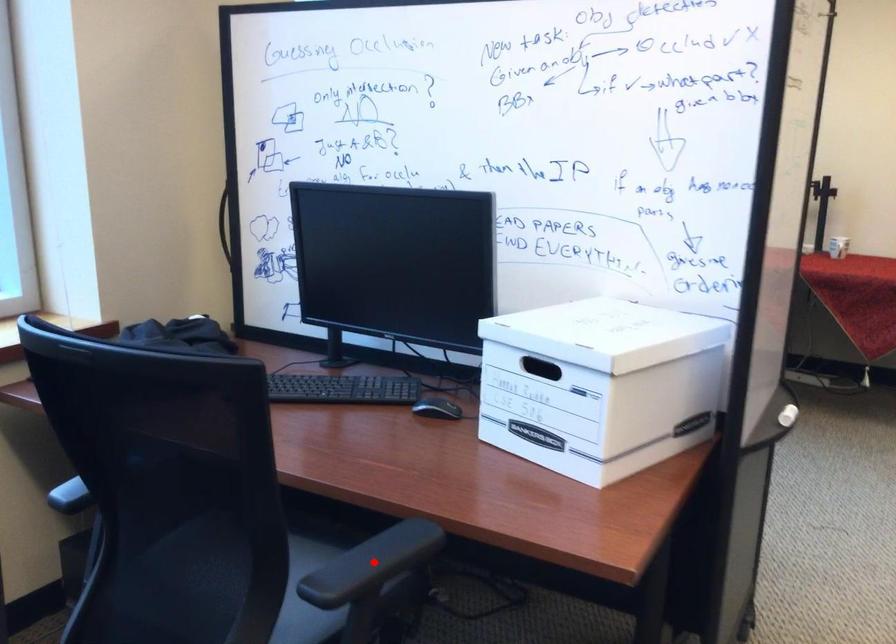
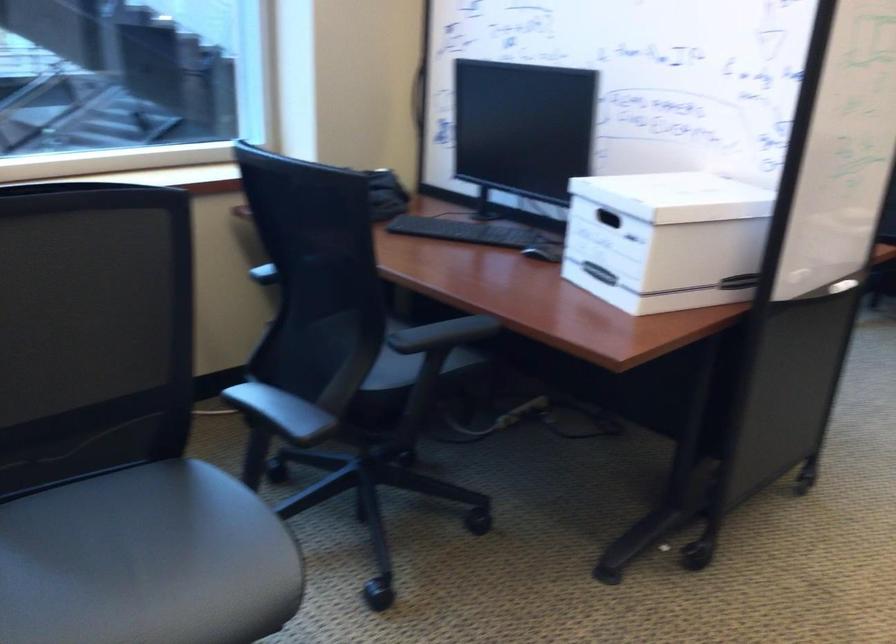
The point at the highlighted location is marked in the first image. Where is the corresponding point in the second image?

(442, 334)